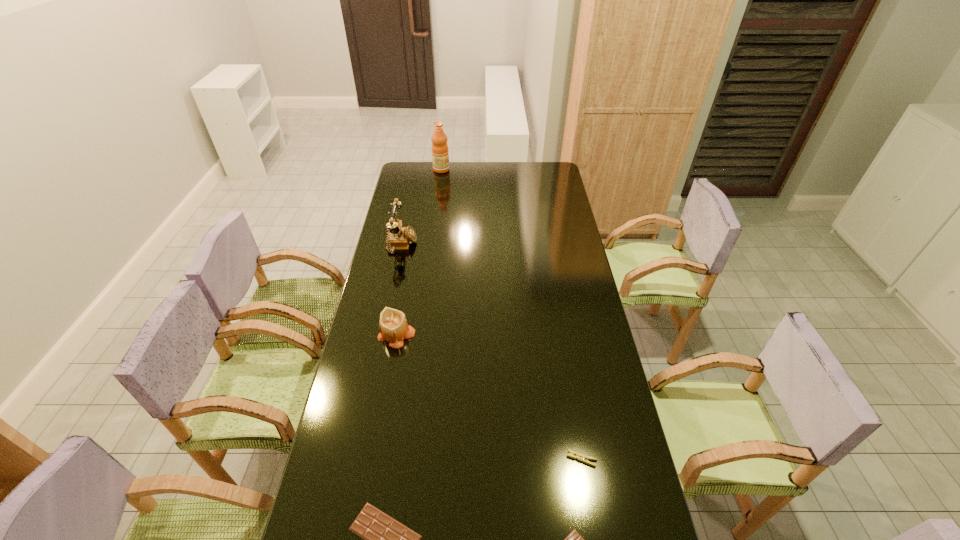
I want to click on free space located 0.060m on the left of the fourth shortest object, so click(361, 336).

You are a GUI agent. You are given a task and a screenshot of the screen. Output one action in this format:
    pyautogui.click(x=<x>, y=<y>)
    Task: Click on the free region located on the left of the clothespin
    
    Given the screenshot: What is the action you would take?
    click(549, 459)

At what (x,y) coordinates should I click in order to perform the action: click on object that is at the far edge. Please return your answer as a coordinate pair (x, y). The height and width of the screenshot is (540, 960). Looking at the image, I should click on (440, 156).

The height and width of the screenshot is (540, 960). Identify the location of telephone present at the left edge. (398, 238).

Find the location of `candle located in the left edge section of the desktop`. candle located in the left edge section of the desktop is located at coordinates (393, 327).

You are a GUI agent. You are given a task and a screenshot of the screen. Output one action in this format:
    pyautogui.click(x=<x>, y=<y>)
    Task: Click on the object that is at the right edge
    
    Given the screenshot: What is the action you would take?
    pyautogui.click(x=580, y=457)

Image resolution: width=960 pixels, height=540 pixels. I want to click on vacant space at the far edge of the desktop, so click(468, 181).

Where is `blank area at the left edge`? The image size is (960, 540). blank area at the left edge is located at coordinates (352, 418).

In the image, there is a desktop. Where is `vacant region at the right edge`? The image size is (960, 540). vacant region at the right edge is located at coordinates 628,474.

Find the location of `vacant space at the far left corner of the desktop`. vacant space at the far left corner of the desktop is located at coordinates click(x=420, y=169).